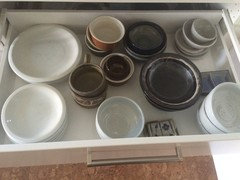
Where is `brown bowl`? The height and width of the screenshot is (180, 240). brown bowl is located at coordinates (90, 91), (89, 99).